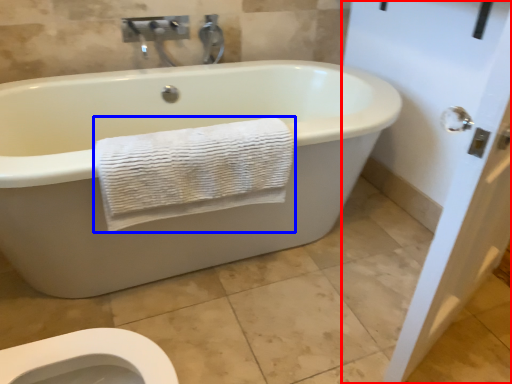
Question: Which object appears farthest to the camera in this image, screen door (highlighted by a red box) or towel (highlighted by a blue box)?

Choices:
 (A) screen door
 (B) towel

Answer: (B)